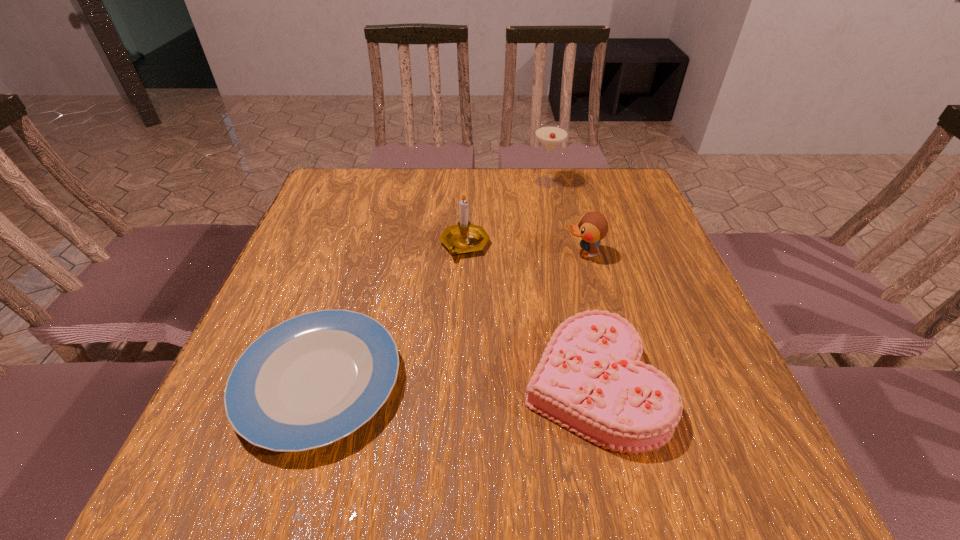
Image resolution: width=960 pixels, height=540 pixels. I want to click on the farthest object, so click(550, 136).

The width and height of the screenshot is (960, 540). Find the location of `the second object from left to right`. the second object from left to right is located at coordinates (464, 237).

Locate an element on the screen. The height and width of the screenshot is (540, 960). duck is located at coordinates coord(592,227).

This screenshot has width=960, height=540. Identify the location of the second shortest object. (590, 379).

I want to click on the shortest object, so click(x=316, y=378).

The height and width of the screenshot is (540, 960). What are the coordinates of `the leftmost object` in the screenshot? It's located at (316, 378).

Locate an element on the screen. This screenshot has height=540, width=960. free region located on the right of the farthest object is located at coordinates (629, 182).

At what (x,y) coordinates should I click in order to perform the action: click on vacant position located 0.310m on the front of the candle holder. Please return your answer as a coordinate pair (x, y). The image size is (960, 540). Looking at the image, I should click on (459, 376).

Identify the location of free region located on the front-facing side of the duck. (543, 254).

Identify the location of vacant point located on the front-facing side of the duck. Image resolution: width=960 pixels, height=540 pixels. (501, 254).